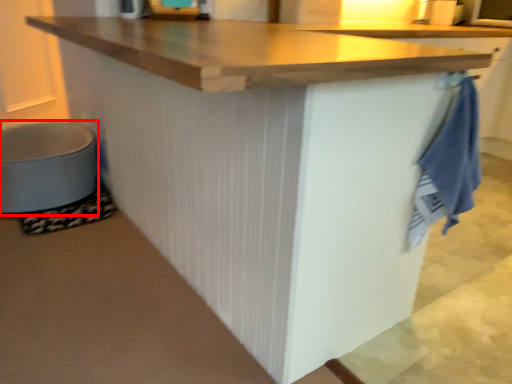
Question: In this image, where is step stool (annotated by the red box) located relative to bath towel?

Choices:
 (A) left
 (B) right

Answer: (A)